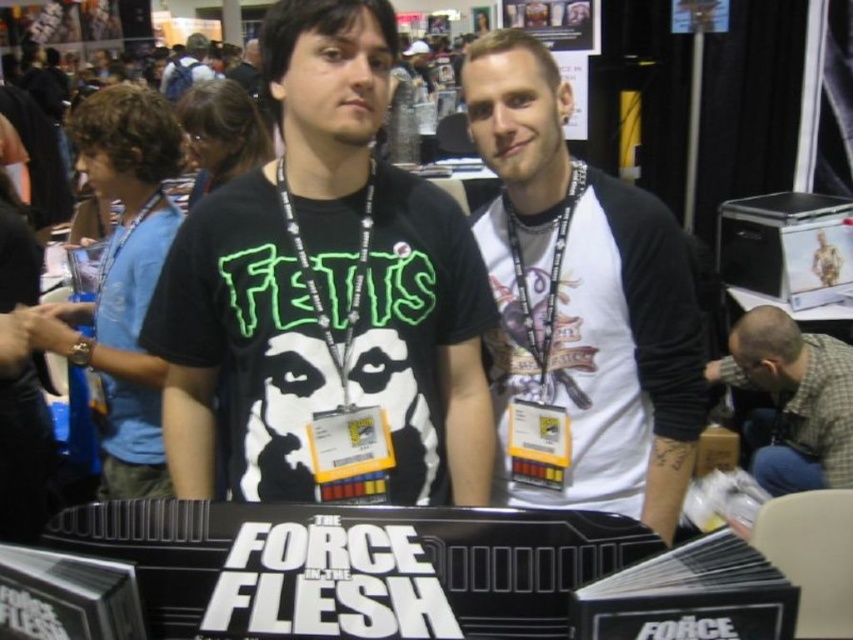
You are an event organizer at the convention. You need to ensure that attendees are following the social distancing guidelines, which require maintaining at least 6 meters between people. You notice the gray plaid shirt at lower right and the blue backpack at upper left in your camera feed. Can you confirm if they are maintaining the required distance?

The distance between the gray plaid shirt at lower right and the blue backpack at upper left is 6.17 meters, which exceeds the 6 meter requirement. Therefore, they are maintaining the required social distancing guidelines.